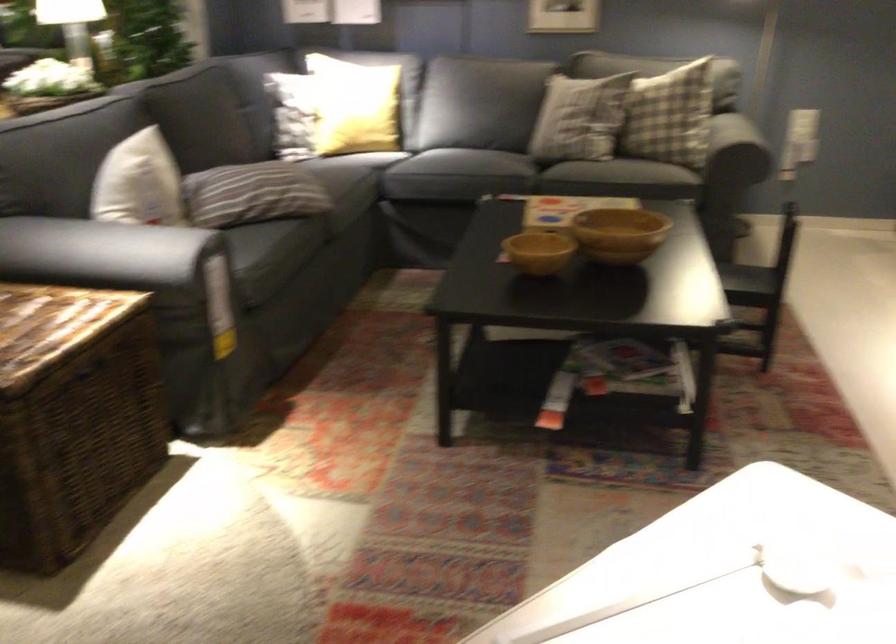
Where is `plaid pillow`? This screenshot has width=896, height=644. plaid pillow is located at coordinates [668, 115].